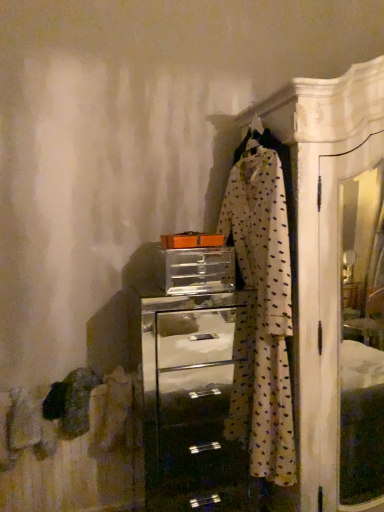
Question: Is metallic silver chest of drawers at center wider or thinner than white dotted fabric at center?

Choices:
 (A) thin
 (B) wide

Answer: (B)

Question: From a real-world perspective, is metallic silver chest of drawers at center physically located above or below white dotted fabric at center?

Choices:
 (A) above
 (B) below

Answer: (B)

Question: Which object is the farthest from the metallic silver chest of drawers at center?

Choices:
 (A) white dotted fabric at center
 (B) clear plastic drawer at center

Answer: (B)

Question: Estimate the real-world distances between objects in this image. Which object is farther from the white dotted fabric at center?

Choices:
 (A) metallic silver chest of drawers at center
 (B) clear plastic drawer at center

Answer: (A)